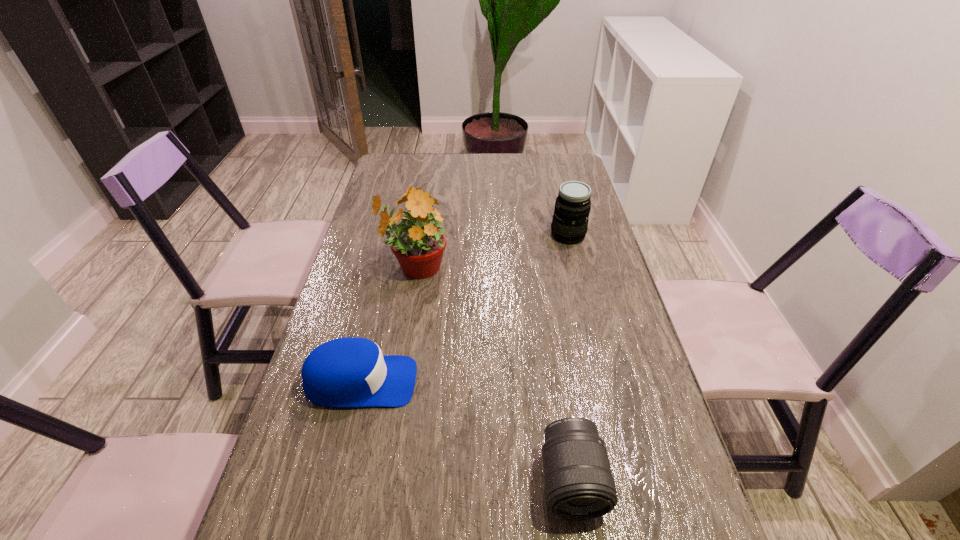
The image size is (960, 540). Identify the location of flowerpot. (418, 242).

You are a GUI agent. You are given a task and a screenshot of the screen. Output one action in this format:
    pyautogui.click(x=<x>, y=<y>)
    Task: Click on the farther telephoto lens
    The image size is (960, 540).
    Given the screenshot: What is the action you would take?
    pyautogui.click(x=569, y=225)

The width and height of the screenshot is (960, 540). What are the coordinates of `the third shortest object` in the screenshot? It's located at (569, 225).

I want to click on the nearer telephoto lens, so click(579, 485).

Locate an element on the screen. The height and width of the screenshot is (540, 960). the nearest object is located at coordinates (579, 485).

Find the location of a particular element. the shortest object is located at coordinates (346, 372).

You are a GUI agent. You are given a task and a screenshot of the screen. Output one action in this format:
    pyautogui.click(x=<x>, y=<y>)
    Task: Click on the baseball cap
    
    Given the screenshot: What is the action you would take?
    pyautogui.click(x=346, y=372)

Where is `vacant space located on the back of the tallest object`? This screenshot has height=540, width=960. vacant space located on the back of the tallest object is located at coordinates (420, 233).

Identify the location of vacant area situated on the left of the farther telephoto lens. The height and width of the screenshot is (540, 960). (494, 235).

This screenshot has width=960, height=540. Find the location of `vacant position located on the front-facing side of the baseball cap`. vacant position located on the front-facing side of the baseball cap is located at coordinates (525, 382).